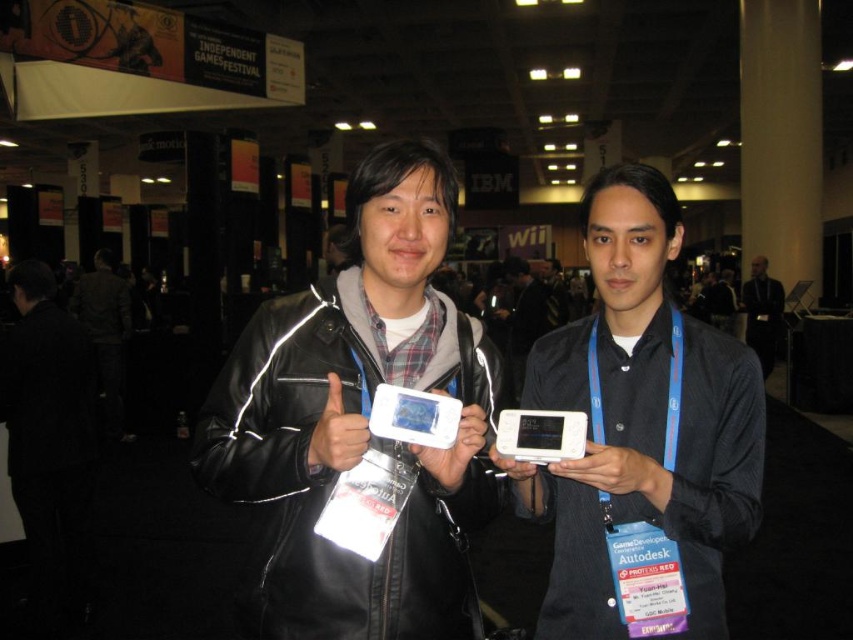
You are standing in the convention hall and want to reach the point marked at coordinates (x=416, y=244). If you can walk 4 feet per second, how long will it take you to reach that point?

The point marked at coordinates (x=416, y=244) is 3.85 feet away from you. At a walking speed of 4 feet per second, it will take approximately 0.96 seconds to reach the point.

You are at a gaming convention and need to take a photo of the matte black phone at center without blocking the black leather jacket at center in the background. Is it possible to do so while keeping both in frame?

The black leather jacket at center is positioned under the matte black phone at center, so you can angle your camera to capture the matte black phone at center while ensuring the black leather jacket at center remains visible behind it in the frame.

You are organizing a photo shoot and need to ensure that the white matte phone at center is visible in the frame. Given that the dark gray shirt at center is blocking part of it, can you determine if the phone will still be mostly visible above the shirt?

The white matte phone at center is not as tall as dark gray shirt at center, so it is possible that the phone will be mostly visible above the shirt since it is shorter than the shirt and positioned at the center.